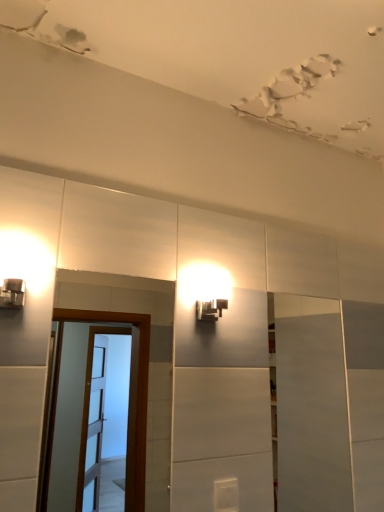
Question: Considering the relative positions of white glossy door at right and matte black light fixture at upper center in the image provided, is white glossy door at right to the right of matte black light fixture at upper center from the viewer's perspective?

Choices:
 (A) yes
 (B) no

Answer: (A)

Question: Is matte black light fixture at upper center a part of white glossy door at right?

Choices:
 (A) no
 (B) yes

Answer: (A)

Question: Can you confirm if white glossy door at right is shorter than matte black light fixture at upper center?

Choices:
 (A) yes
 (B) no

Answer: (B)

Question: Is white glossy door at right in front of matte black light fixture at upper center?

Choices:
 (A) yes
 (B) no

Answer: (B)

Question: Can you confirm if white glossy door at right is thinner than matte black light fixture at upper center?

Choices:
 (A) yes
 (B) no

Answer: (A)

Question: From a real-world perspective, is white glossy door at right above or below brown wooden screen door at left?

Choices:
 (A) below
 (B) above

Answer: (A)

Question: In terms of height, does white glossy door at right look taller or shorter compared to brown wooden screen door at left?

Choices:
 (A) tall
 (B) short

Answer: (A)

Question: In terms of width, does white glossy door at right look wider or thinner when compared to brown wooden screen door at left?

Choices:
 (A) thin
 (B) wide

Answer: (B)

Question: In terms of size, does white glossy door at right appear bigger or smaller than brown wooden screen door at left?

Choices:
 (A) big
 (B) small

Answer: (A)

Question: From a real-world perspective, is white plastic light switch at lower center above or below brown wooden screen door at left?

Choices:
 (A) below
 (B) above

Answer: (A)

Question: Considering the positions of white plastic light switch at lower center and brown wooden screen door at left in the image, is white plastic light switch at lower center wider or thinner than brown wooden screen door at left?

Choices:
 (A) wide
 (B) thin

Answer: (A)

Question: Is point (221, 499) positioned closer to the camera than point (135, 444)?

Choices:
 (A) farther
 (B) closer

Answer: (B)

Question: Visually, is white plastic light switch at lower center positioned to the left or to the right of brown wooden screen door at left?

Choices:
 (A) right
 (B) left

Answer: (A)

Question: From the image's perspective, is white plastic light switch at lower center positioned above or below matte black light fixture at upper center?

Choices:
 (A) below
 (B) above

Answer: (A)

Question: Looking at their shapes, would you say white plastic light switch at lower center is wider or thinner than matte black light fixture at upper center?

Choices:
 (A) thin
 (B) wide

Answer: (A)